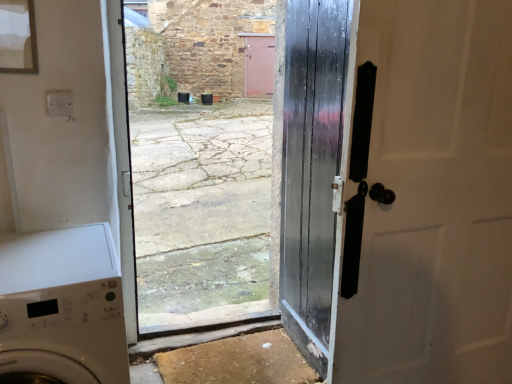
Question: Is matte black door at right, the first door when ordered from right to left, completely or partially inside glossy black door at center, placed as the 2th door when sorted from right to left?

Choices:
 (A) yes
 (B) no

Answer: (B)

Question: Is glossy black door at center, the first door when ordered from left to right, at the left side of matte black door at right, the first door when ordered from right to left?

Choices:
 (A) no
 (B) yes

Answer: (B)

Question: From a real-world perspective, is glossy black door at center, placed as the 2th door when sorted from right to left, over matte black door at right, the first door when ordered from right to left?

Choices:
 (A) no
 (B) yes

Answer: (A)

Question: Is glossy black door at center, the first door when ordered from left to right, with matte black door at right, positioned as the second door in left-to-right order?

Choices:
 (A) no
 (B) yes

Answer: (A)

Question: From a real-world perspective, is glossy black door at center, the first door when ordered from left to right, located beneath matte black door at right, the first door when ordered from right to left?

Choices:
 (A) no
 (B) yes

Answer: (B)

Question: Is point (97, 316) positioned closer to the camera than point (300, 96)?

Choices:
 (A) farther
 (B) closer

Answer: (B)

Question: From a real-world perspective, is white glossy washing machine at lower left above or below glossy black door at center, the first door when ordered from left to right?

Choices:
 (A) above
 (B) below

Answer: (B)

Question: In terms of size, does white glossy washing machine at lower left appear bigger or smaller than glossy black door at center, the first door when ordered from left to right?

Choices:
 (A) big
 (B) small

Answer: (A)

Question: Is white glossy washing machine at lower left in front of or behind glossy black door at center, placed as the 2th door when sorted from right to left, in the image?

Choices:
 (A) behind
 (B) front

Answer: (B)

Question: From the image's perspective, is glossy black door at center, placed as the 2th door when sorted from right to left, located above or below matte black door at right, the first door when ordered from right to left?

Choices:
 (A) above
 (B) below

Answer: (A)

Question: Is point (323, 185) positioned closer to the camera than point (352, 34)?

Choices:
 (A) closer
 (B) farther

Answer: (B)

Question: Is glossy black door at center, the first door when ordered from left to right, to the left or to the right of matte black door at right, positioned as the second door in left-to-right order, in the image?

Choices:
 (A) right
 (B) left

Answer: (B)

Question: Looking at the image, does glossy black door at center, the first door when ordered from left to right, seem bigger or smaller compared to matte black door at right, positioned as the second door in left-to-right order?

Choices:
 (A) big
 (B) small

Answer: (B)

Question: Considering the relative positions of matte black door at right, the first door when ordered from right to left, and glossy black door at center, placed as the 2th door when sorted from right to left, in the image provided, is matte black door at right, the first door when ordered from right to left, to the left or to the right of glossy black door at center, placed as the 2th door when sorted from right to left,?

Choices:
 (A) left
 (B) right

Answer: (B)

Question: From a real-world perspective, is matte black door at right, positioned as the second door in left-to-right order, above or below glossy black door at center, the first door when ordered from left to right?

Choices:
 (A) below
 (B) above

Answer: (B)